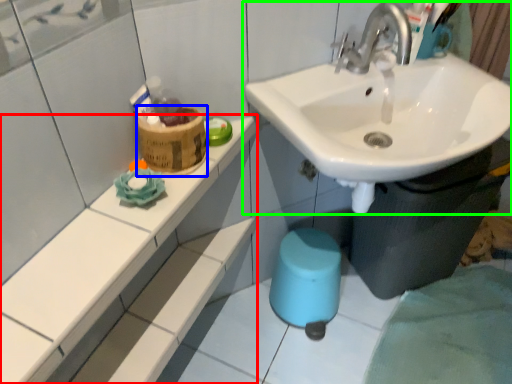
Question: Which object is positioned closest to counter top (highlighted by a red box)? Select from potty (highlighted by a blue box) and sink (highlighted by a green box).

Choices:
 (A) potty
 (B) sink

Answer: (A)